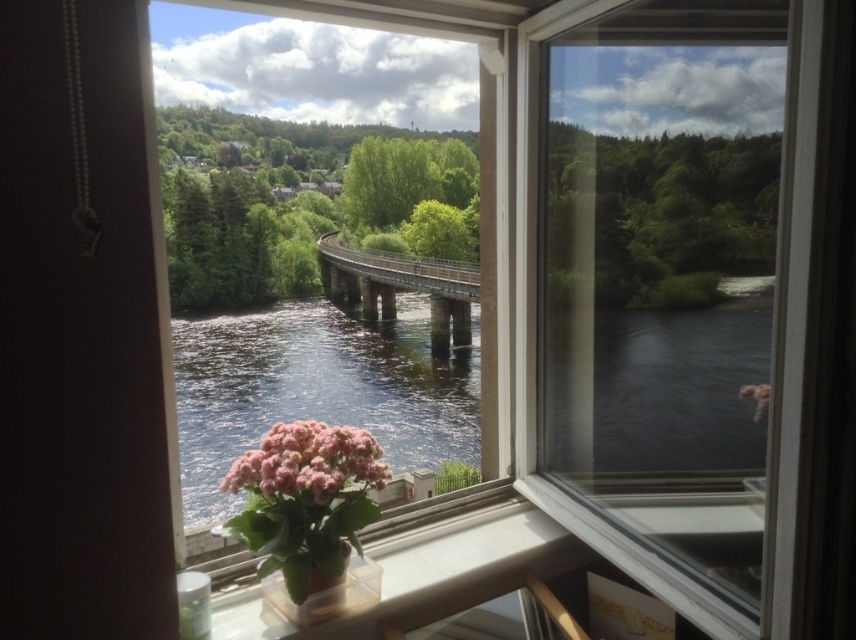
You are arranging flowers in a vase for a centerpiece. You have a pink matte flower at lower center and a green matte vase at lower center. Which object should you place first to ensure stability?

The pink matte flower at lower center is larger in size than the green matte vase at lower center, so you should place the green matte vase at lower center first to ensure stability.

You are standing at the window and see two points marked on the glass. The first point is at coordinate point[514,500] and the second is at point[369,560]. Which point is closer to you?

Point[369,560] is closer to you because it is in front of point[514,500].

You are an architect designing a new observation deck that needs to be placed over the dark reflective water at center and the metal bridge at center. Since the deck must cover the larger object, which object should it be placed over?

The dark reflective water at center has a larger size compared to metal bridge at center, so the observation deck should be placed over the dark reflective water at center to cover the larger object.